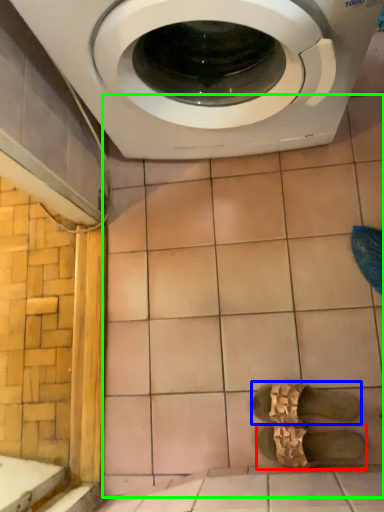
Question: Considering the real-world distances, which object is closest to shoe (highlighted by a red box)? shoe (highlighted by a blue box) or ceramic tile (highlighted by a green box).

Choices:
 (A) shoe
 (B) ceramic tile

Answer: (A)